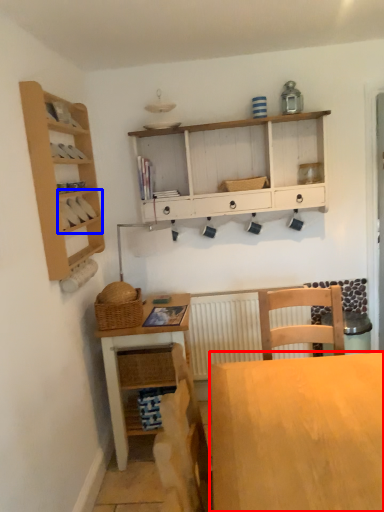
Question: Which point is closer to the camera, desk (highlighted by a red box) or cabinet (highlighted by a blue box)?

Choices:
 (A) desk
 (B) cabinet

Answer: (A)